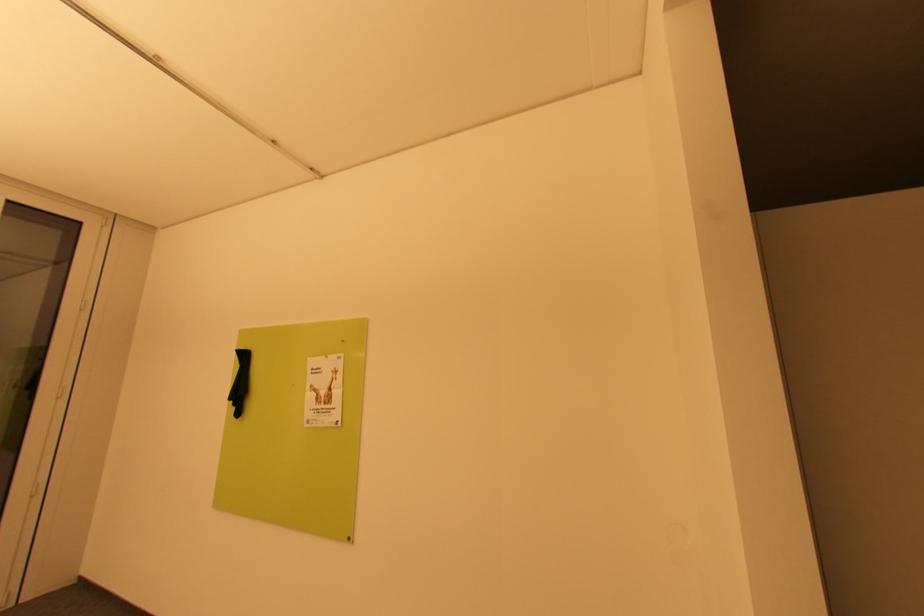
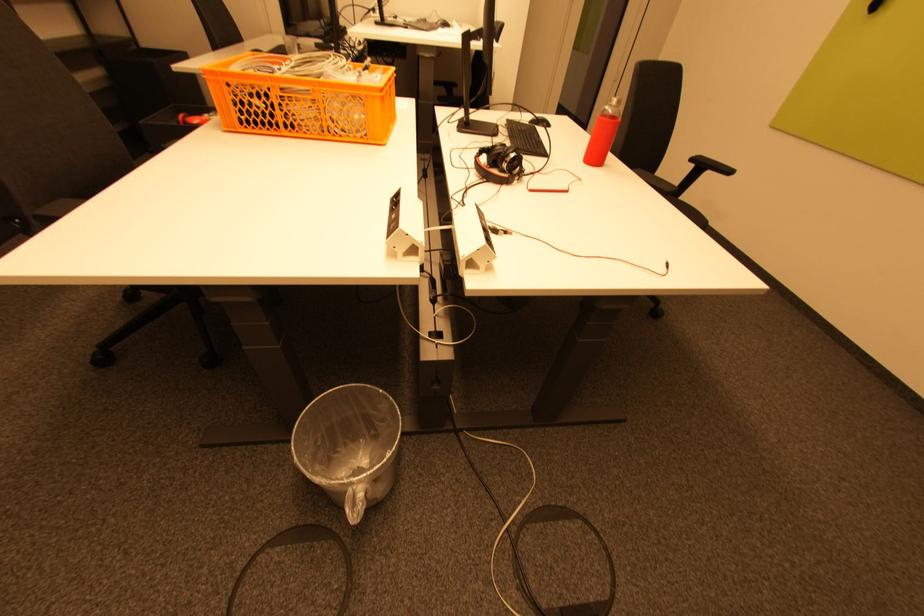
The first image is from the beginning of the video and the second image is from the end. How did the camera likely rotate when shooting the video?

The camera's rotation is toward left-down.